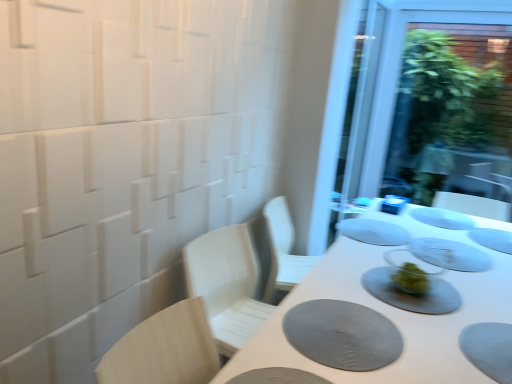
Where is `vacant space that's between gray matte placemat at center, positioned as the 3th tableware in front-to-back order, and clear glass plate at center, the fifth tableware positioned from the back`? vacant space that's between gray matte placemat at center, positioned as the 3th tableware in front-to-back order, and clear glass plate at center, the fifth tableware positioned from the back is located at coordinates (464, 245).